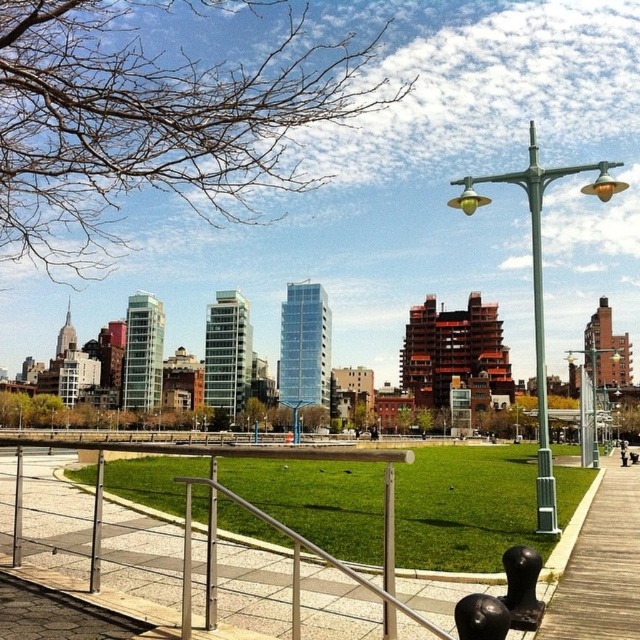
You are a photographer standing at the entrance of the park. You want to take a photo that includes both the silver metallic rail at center and the wooden park bench at center. Which object should you focus on first to ensure both are in frame?

You should focus on the silver metallic rail at center first because it is closer to the viewer than the wooden park bench at center, so adjusting the camera to include it will naturally bring the bench into the frame as well.